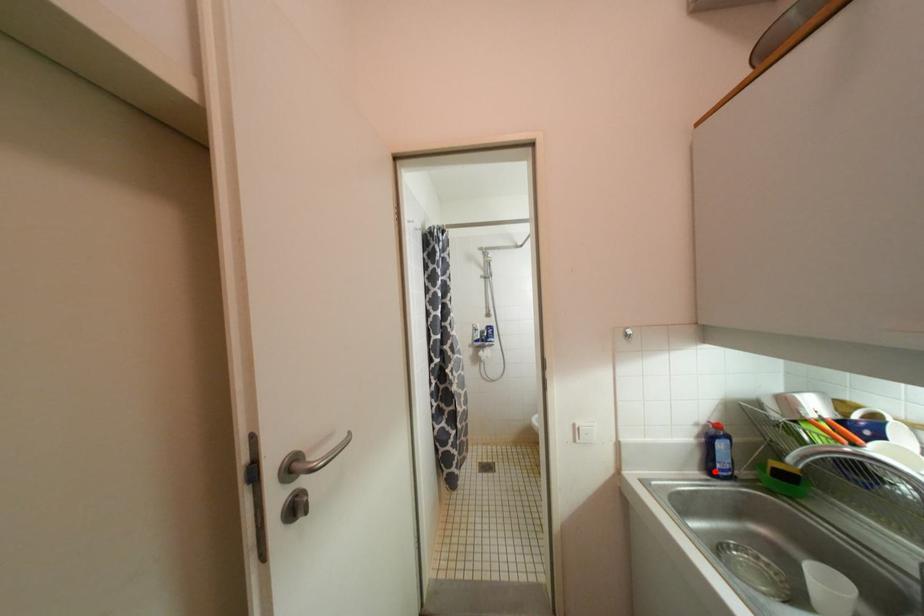
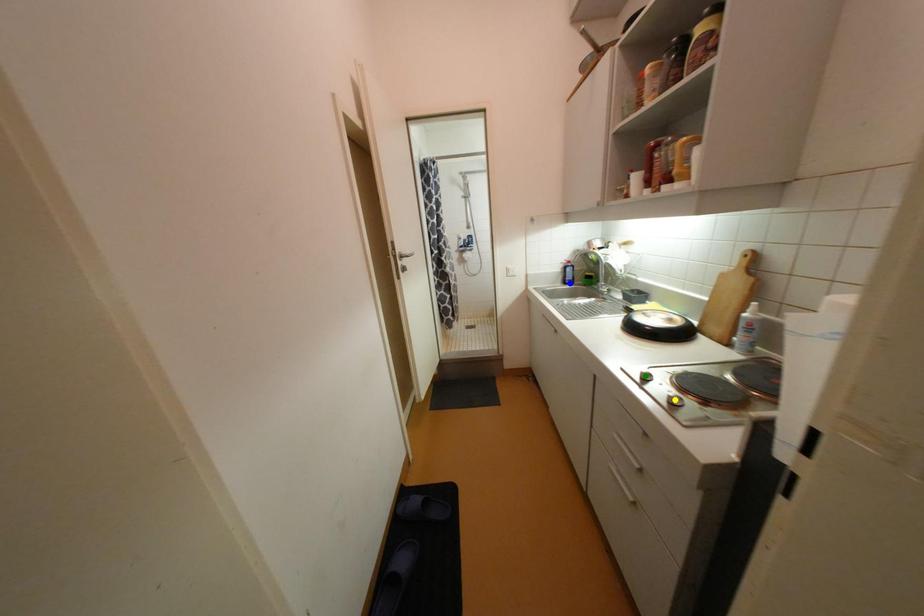
Question: I am providing you with two images of the same scene from different viewpoints. A red point is marked on the first image. You are given multiple points on the second image. Which spot in image 2 lines up with the point in image 1?

Choices:
 (A) yellow point
 (B) green point
 (C) blue point

Answer: (C)